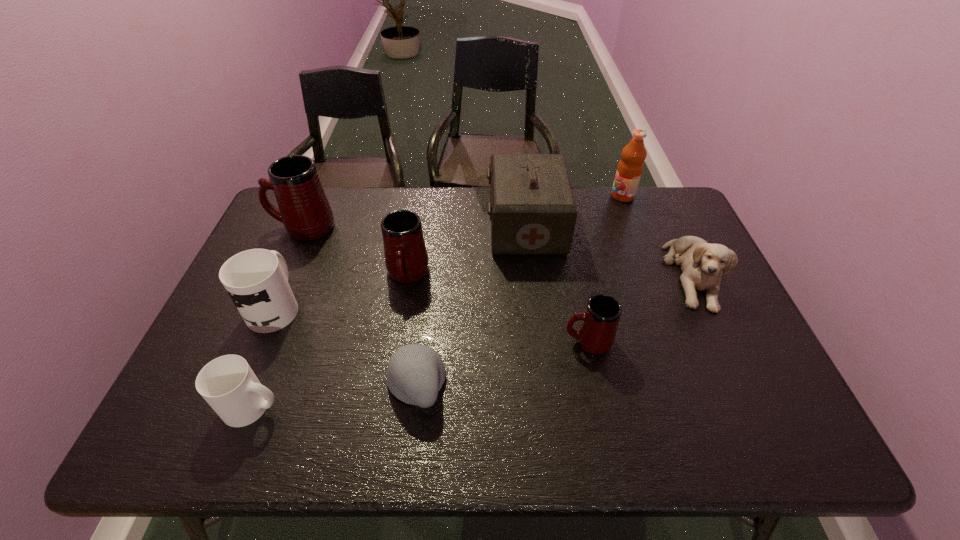
Find the location of `vacant space located on the handle side of the bigger white mug`. vacant space located on the handle side of the bigger white mug is located at coordinates (294, 262).

What are the coordinates of `vacant point located on the handle side of the bigger white mug` in the screenshot? It's located at (319, 204).

Identify the location of vacant space positioned on the handle side of the bigger white mug. (311, 222).

Locate an element on the screen. free spot located 0.140m on the front-facing side of the white puppy is located at coordinates (732, 359).

I want to click on blank space located 0.340m on the side of the rightmost mug with the handle, so click(428, 341).

The height and width of the screenshot is (540, 960). In order to click on blank space located on the side of the rightmost mug with the handle in this screenshot , I will do `click(500, 341)`.

Locate an element on the screen. The image size is (960, 540). free space located 0.060m on the side of the rightmost mug with the handle is located at coordinates (540, 341).

Find the location of a particular element. The width and height of the screenshot is (960, 540). vacant space located 0.150m on the handle side of the nearer white mug is located at coordinates click(x=350, y=406).

This screenshot has height=540, width=960. In order to click on blank space located on the left of the shortest object in this screenshot , I will do `click(348, 383)`.

Where is `fruit juice positioned at the far edge`? Image resolution: width=960 pixels, height=540 pixels. fruit juice positioned at the far edge is located at coordinates (630, 167).